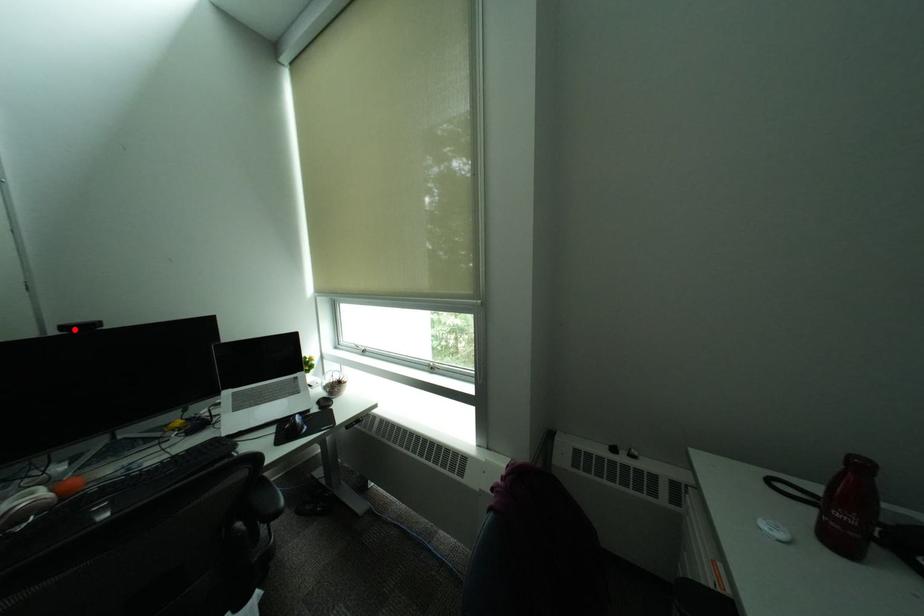
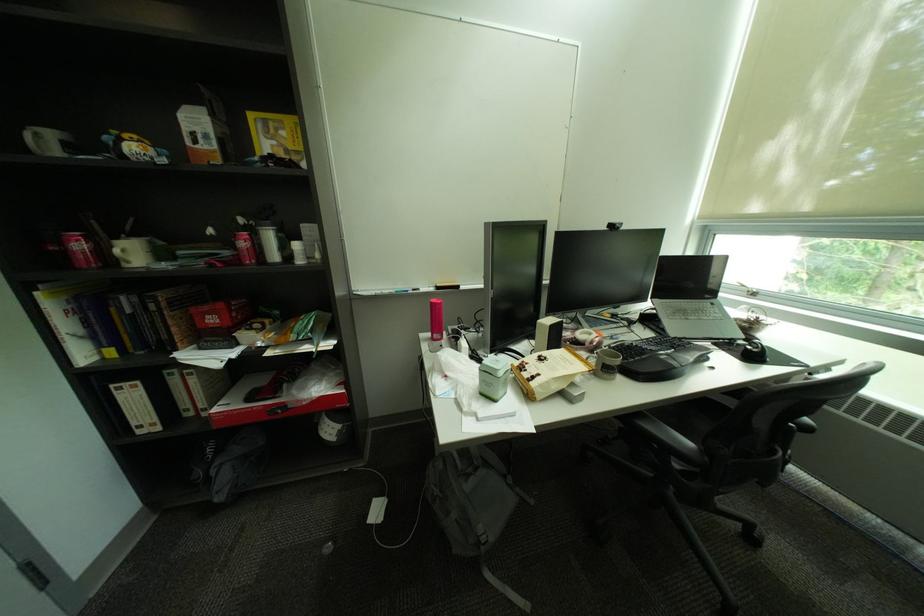
In the second image, find the point that corresponds to the highlighted location in the first image.

(621, 227)